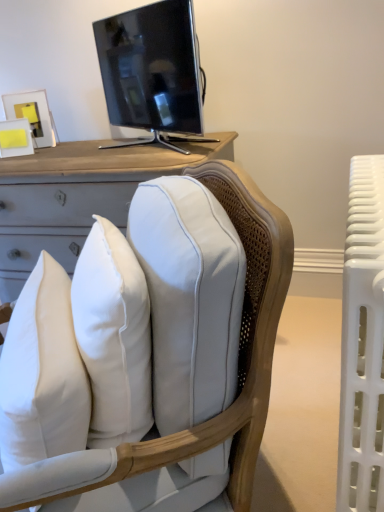
Question: Is matte black tv at upper center further to the viewer compared to white soft pillow at center?

Choices:
 (A) yes
 (B) no

Answer: (A)

Question: Is matte black tv at upper center aimed at white soft pillow at center?

Choices:
 (A) no
 (B) yes

Answer: (A)

Question: From the image's perspective, would you say matte black tv at upper center is shown under white soft pillow at center?

Choices:
 (A) no
 (B) yes

Answer: (A)

Question: From a real-world perspective, is matte black tv at upper center located beneath white soft pillow at center?

Choices:
 (A) yes
 (B) no

Answer: (B)

Question: Is matte black tv at upper center far from white soft pillow at center?

Choices:
 (A) no
 (B) yes

Answer: (A)

Question: In the image, is white soft pillow at center positioned in front of or behind matte black tv at upper center?

Choices:
 (A) front
 (B) behind

Answer: (A)

Question: From a real-world perspective, is white soft pillow at center positioned above or below matte black tv at upper center?

Choices:
 (A) above
 (B) below

Answer: (B)

Question: Based on their sizes in the image, would you say white soft pillow at center is bigger or smaller than matte black tv at upper center?

Choices:
 (A) big
 (B) small

Answer: (B)

Question: In terms of width, does white soft pillow at center look wider or thinner when compared to matte black tv at upper center?

Choices:
 (A) thin
 (B) wide

Answer: (A)

Question: In terms of height, does white leather chair at center look taller or shorter compared to matte black tv at upper center?

Choices:
 (A) tall
 (B) short

Answer: (A)

Question: From the image's perspective, is white leather chair at center located above or below matte black tv at upper center?

Choices:
 (A) above
 (B) below

Answer: (B)

Question: Is white leather chair at center to the left or to the right of matte black tv at upper center in the image?

Choices:
 (A) left
 (B) right

Answer: (A)

Question: Looking at their shapes, would you say white leather chair at center is wider or thinner than matte black tv at upper center?

Choices:
 (A) wide
 (B) thin

Answer: (A)

Question: Considering the positions of white plastic radiator at right and white leather chair at center in the image, is white plastic radiator at right wider or thinner than white leather chair at center?

Choices:
 (A) thin
 (B) wide

Answer: (A)

Question: From a real-world perspective, is white plastic radiator at right above or below white leather chair at center?

Choices:
 (A) above
 (B) below

Answer: (B)